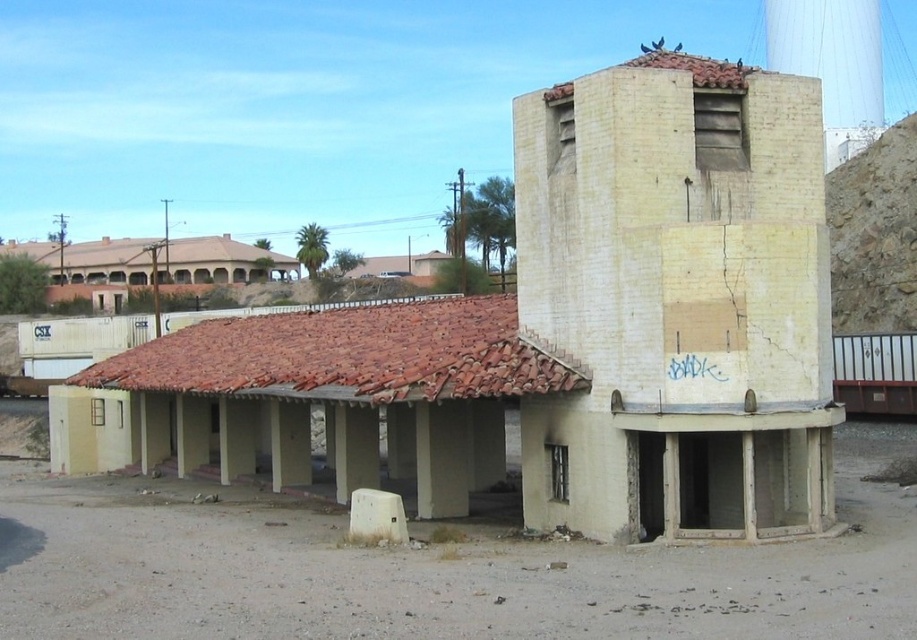
Which is behind, point (525, 108) or point (790, 52)?

The point (790, 52) is behind.

Identify the location of yellowish concrete tower at upper right. This screenshot has height=640, width=917. (676, 301).